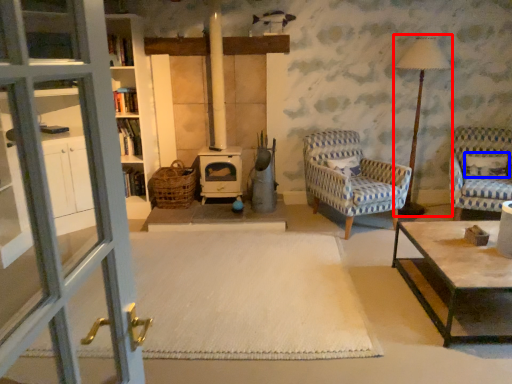
Question: Among these objects, which one is farthest to the camera, table lamp (highlighted by a red box) or pillow (highlighted by a blue box)?

Choices:
 (A) table lamp
 (B) pillow

Answer: (B)